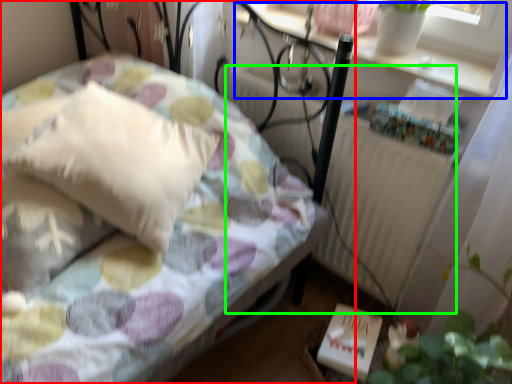
Question: Which object is positioned farthest from bed (highlighted by a red box)? Select from window sill (highlighted by a blue box) and radiator (highlighted by a green box).

Choices:
 (A) window sill
 (B) radiator

Answer: (A)